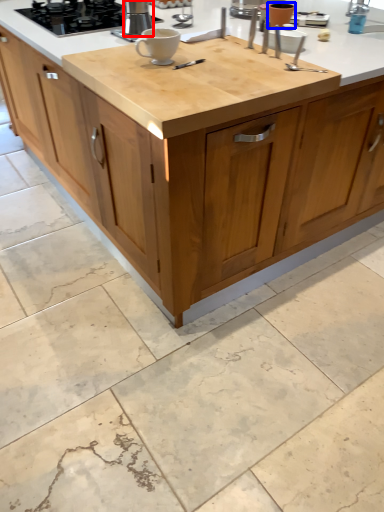
Question: Which object appears farthest to the camera in this image, kitchen appliance (highlighted by a red box) or appliance (highlighted by a blue box)?

Choices:
 (A) kitchen appliance
 (B) appliance

Answer: (B)